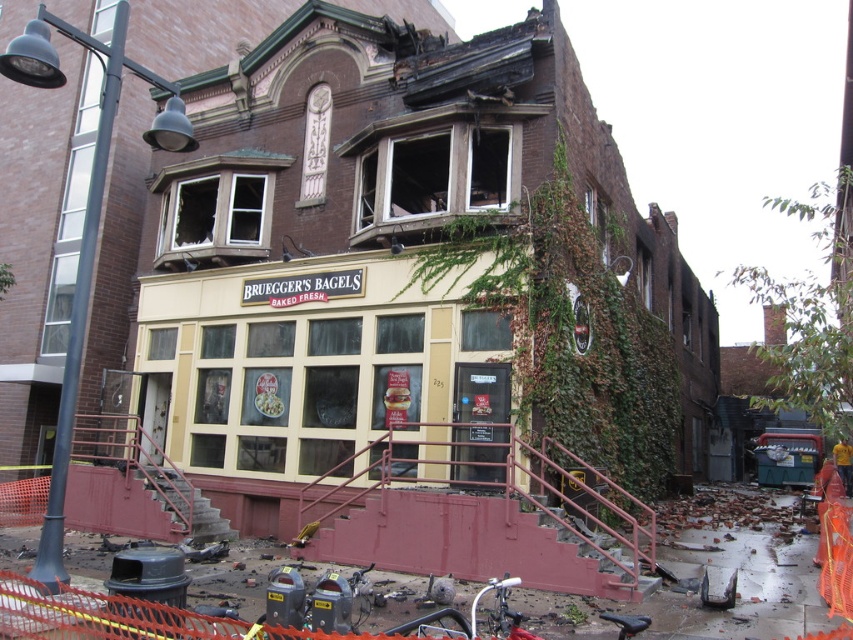
Question: Is green ivy at center wider than green ivy at upper right?

Choices:
 (A) yes
 (B) no

Answer: (B)

Question: Considering the relative positions of green ivy at center and green ivy at upper right in the image provided, where is green ivy at center located with respect to green ivy at upper right?

Choices:
 (A) below
 (B) above

Answer: (A)

Question: Which object appears closest to the camera in this image?

Choices:
 (A) green ivy at upper right
 (B) green ivy at center

Answer: (A)

Question: Can you confirm if green ivy at center is positioned below green ivy at upper right?

Choices:
 (A) yes
 (B) no

Answer: (A)

Question: Which object is closer to the camera taking this photo?

Choices:
 (A) green ivy at center
 (B) green ivy at upper right

Answer: (B)